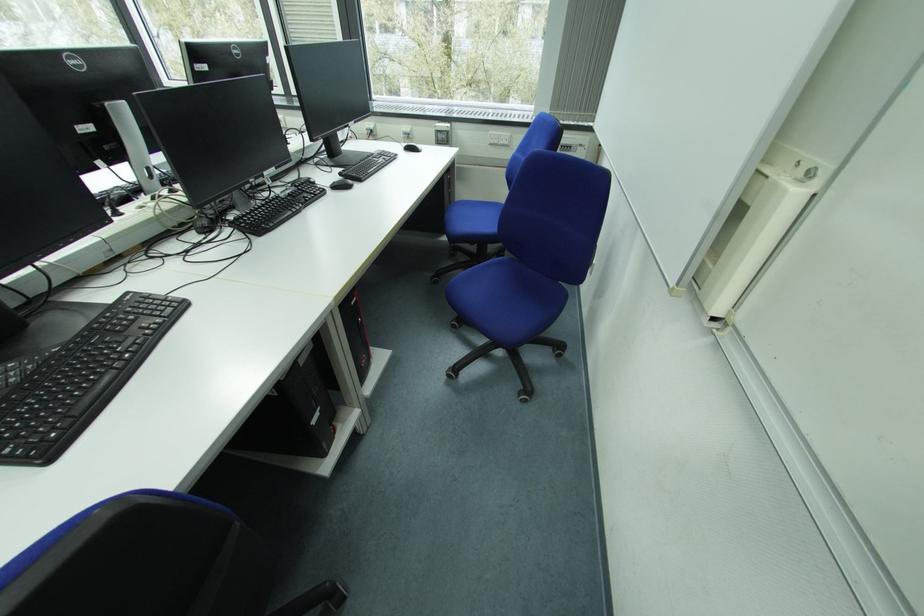
Where is `blue chair sitting surface`? Image resolution: width=924 pixels, height=616 pixels. blue chair sitting surface is located at coordinates (505, 301).